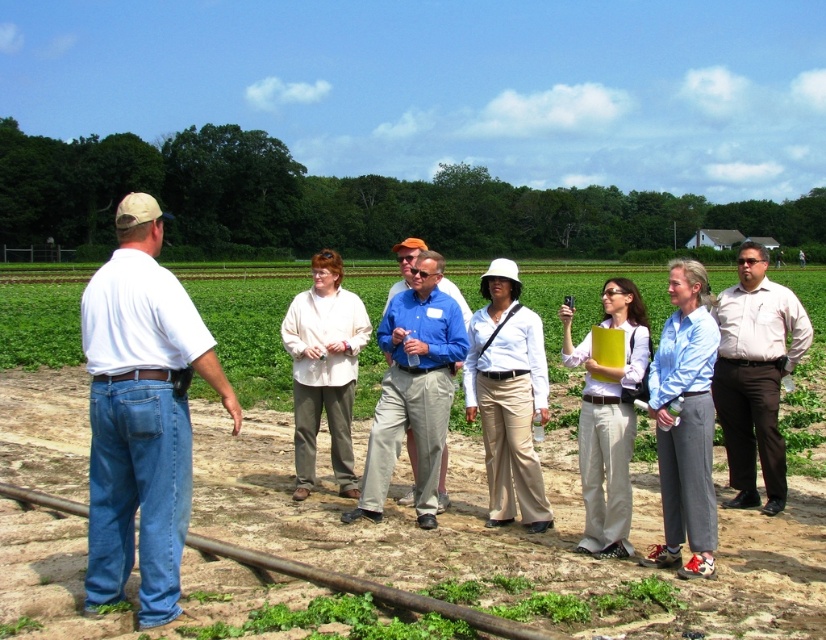
Question: From the image, what is the correct spatial relationship of white cotton shirt at left in relation to light brown shirt at center?

Choices:
 (A) right
 (B) left

Answer: (B)

Question: Which object is positioned farthest from the white matte shirt at center?

Choices:
 (A) white cotton shirt at left
 (B) light blue shirt at center

Answer: (A)

Question: Does white cotton shirt at left appear on the left side of white matte shirt at center?

Choices:
 (A) no
 (B) yes

Answer: (B)

Question: Is light brown shirt at center thinner than light beige shirt at center?

Choices:
 (A) yes
 (B) no

Answer: (B)

Question: Considering the real-world distances, which object is closest to the white cotton shirt at center?

Choices:
 (A) light beige shirt at center
 (B) white cotton shirt at left
 (C) light brown shirt at center
 (D) blue cotton shirt at center

Answer: (C)

Question: Which of the following is the closest to the observer?

Choices:
 (A) (198, 502)
 (B) (705, 291)
 (C) (739, 433)
 (D) (506, 428)

Answer: (B)